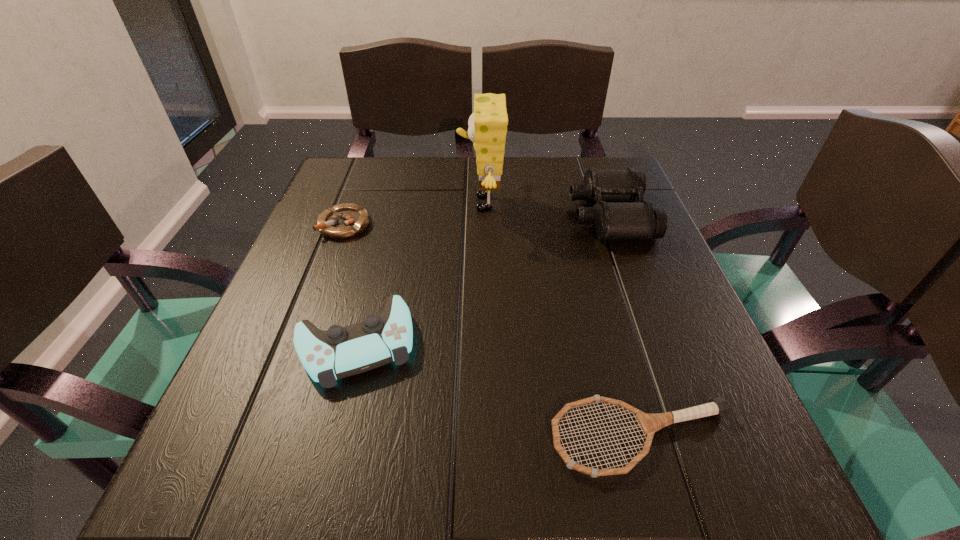
The width and height of the screenshot is (960, 540). Identify the location of ashtray that is at the left edge. (343, 221).

You are a GUI agent. You are given a task and a screenshot of the screen. Output one action in this format:
    pyautogui.click(x=<x>, y=<y>)
    Task: Click on the binoculars that is at the right edge
    This screenshot has height=540, width=960.
    Given the screenshot: What is the action you would take?
    pyautogui.click(x=615, y=216)

The width and height of the screenshot is (960, 540). What are the coordinates of `tennis racket located in the right edge section of the desktop` in the screenshot? It's located at (649, 423).

The image size is (960, 540). What are the coordinates of `object located in the far right corner section of the desktop` in the screenshot? It's located at (615, 216).

At what (x,y) coordinates should I click in order to perform the action: click on object at the near right corner. Please return your answer as a coordinate pair (x, y). This screenshot has height=540, width=960. Looking at the image, I should click on (649, 423).

At what (x,y) coordinates should I click in order to perform the action: click on free space at the far edge of the desktop. Please return your answer as a coordinate pair (x, y). Image resolution: width=960 pixels, height=540 pixels. Looking at the image, I should click on (537, 157).

The image size is (960, 540). In order to click on free space at the left edge of the desktop in this screenshot , I will do `click(343, 307)`.

I want to click on free region at the right edge of the desktop, so click(660, 365).

The width and height of the screenshot is (960, 540). I want to click on vacant space at the far left corner, so click(345, 172).

You are a GUI agent. You are given a task and a screenshot of the screen. Output one action in this format:
    pyautogui.click(x=<x>, y=<y>)
    Task: Click on the blank space at the near left corner of the desktop
    This screenshot has width=960, height=540.
    Given the screenshot: What is the action you would take?
    pyautogui.click(x=252, y=482)